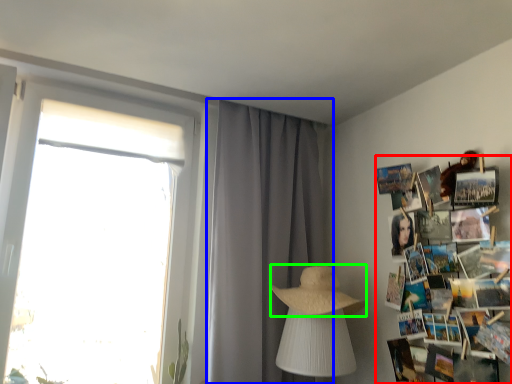
Question: Based on their relative distances, which object is nearer to magazine (highlighted by a red box)? Choose from curtain (highlighted by a blue box) and straw hat (highlighted by a green box).

Choices:
 (A) curtain
 (B) straw hat

Answer: (B)